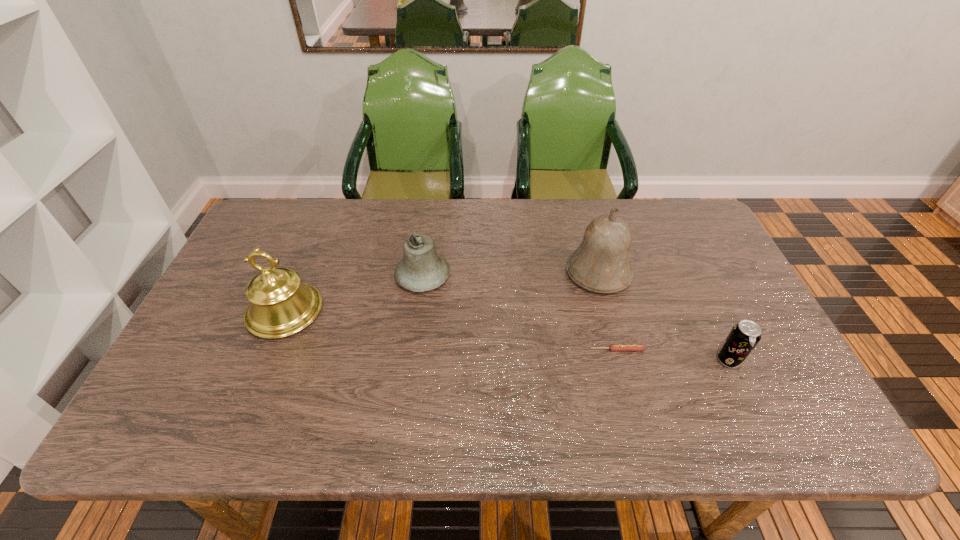
At what (x,y) coordinates should I click in order to perform the action: click on free space located 0.060m on the front of the soda can. Please return your answer as a coordinate pair (x, y). This screenshot has height=540, width=960. Looking at the image, I should click on click(744, 393).

Locate an element on the screen. The width and height of the screenshot is (960, 540). vacant area situated 0.060m on the right of the shortest object is located at coordinates (668, 350).

You are a GUI agent. You are given a task and a screenshot of the screen. Output one action in this format:
    pyautogui.click(x=<x>, y=<y>)
    Task: Click on the object that is at the left edge
    This screenshot has height=540, width=960.
    Given the screenshot: What is the action you would take?
    pyautogui.click(x=280, y=305)

At what (x,y) coordinates should I click in order to perform the action: click on object located at the right edge. Please return your answer as a coordinate pair (x, y). Looking at the image, I should click on (745, 335).

Image resolution: width=960 pixels, height=540 pixels. Find the location of `vacant area at the far edge of the desktop`. vacant area at the far edge of the desktop is located at coordinates (425, 223).

In the image, there is a desktop. Identify the location of blank space at the near edge. The image size is (960, 540). (540, 428).

Find the location of a particular element. The width and height of the screenshot is (960, 540). free space at the left edge of the desktop is located at coordinates (165, 383).

The width and height of the screenshot is (960, 540). Find the location of `free spot at the right edge of the desktop`. free spot at the right edge of the desktop is located at coordinates (806, 401).

In the image, there is a desktop. At what (x,y) coordinates should I click in order to perform the action: click on vacant area at the far left corner. Please return your answer as a coordinate pair (x, y). Looking at the image, I should click on (278, 232).

Locate an element on the screen. vacant space at the far right corner is located at coordinates (675, 234).